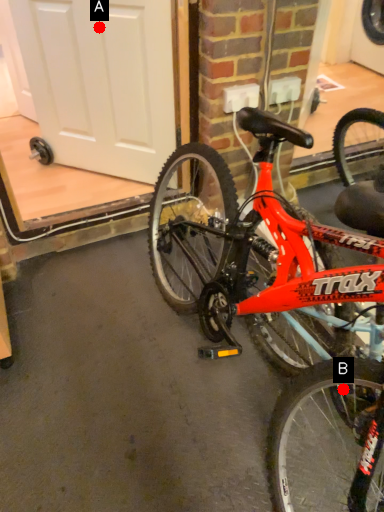
Question: Two points are circled on the image, labeled by A and B beside each circle. Which point is closer to the camera?

Choices:
 (A) A is closer
 (B) B is closer

Answer: (B)